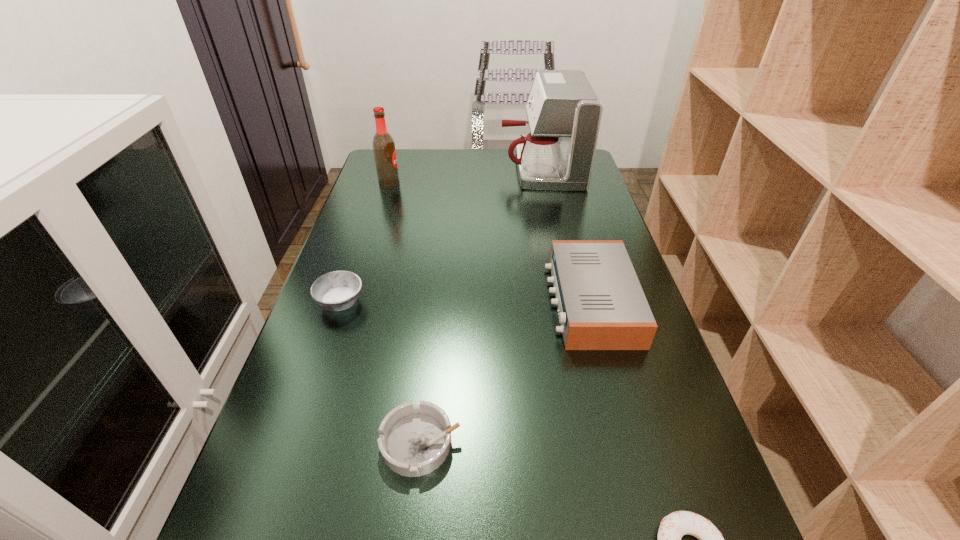
The height and width of the screenshot is (540, 960). I want to click on coffee maker present at the right edge, so click(x=564, y=114).

The image size is (960, 540). I want to click on radio receiver that is at the right edge, so click(x=601, y=304).

Locate an element on the screen. Image resolution: width=960 pixels, height=540 pixels. object situated at the far left corner is located at coordinates (383, 144).

Identify the location of object located at the far right corner. The height and width of the screenshot is (540, 960). (564, 114).

The image size is (960, 540). Find the location of `free space at the far edge of the desktop`. free space at the far edge of the desktop is located at coordinates (452, 150).

At what (x,y) coordinates should I click in order to perform the action: click on blank space at the left edge of the desktop. Please return your answer as a coordinate pair (x, y). Image resolution: width=960 pixels, height=540 pixels. Looking at the image, I should click on (x=380, y=235).

In the image, there is a desktop. Where is `free space at the right edge`? This screenshot has width=960, height=540. free space at the right edge is located at coordinates (639, 480).

This screenshot has width=960, height=540. In order to click on vacant space that is in between the left ashtray and the coffee maker in this screenshot , I will do `click(441, 235)`.

Find the location of `unoccupied area between the coffee maker and the radio receiver`. unoccupied area between the coffee maker and the radio receiver is located at coordinates (565, 235).

The width and height of the screenshot is (960, 540). I want to click on vacant point located between the coffee maker and the fourth shortest object, so [565, 235].